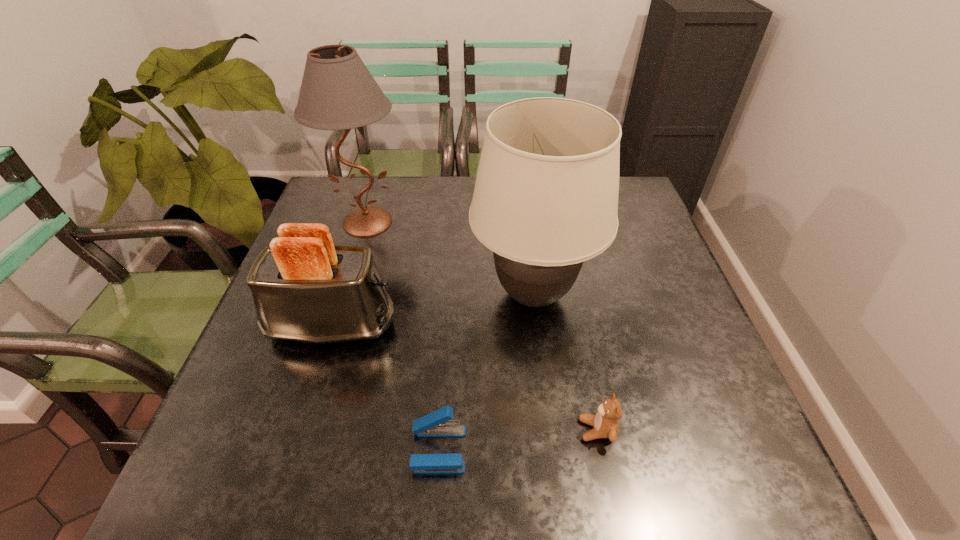
You are a GUI agent. You are given a task and a screenshot of the screen. Output one action in this format:
    pyautogui.click(x=<x>, y=<y>)
    Task: Click on the free spot at the near edge of the desktop
    Image resolution: width=960 pixels, height=540 pixels.
    Given the screenshot: What is the action you would take?
    pyautogui.click(x=477, y=474)

In the image, there is a desktop. Where is `vacant space at the right edge`? vacant space at the right edge is located at coordinates (708, 384).

Find the location of a particular element. The height and width of the screenshot is (540, 960). empty location between the teddy bear and the farthest object is located at coordinates (482, 326).

Where is `free space that is in between the third shortest object and the fourth tallest object`? The height and width of the screenshot is (540, 960). free space that is in between the third shortest object and the fourth tallest object is located at coordinates [x=465, y=377].

Where is `free point between the shortest object and the toaster`? The width and height of the screenshot is (960, 540). free point between the shortest object and the toaster is located at coordinates (385, 387).

Identify the location of vacant space in between the fourth tallest object and the third object from left to right. The height and width of the screenshot is (540, 960). (517, 440).

The height and width of the screenshot is (540, 960). I want to click on free area in between the third object from right to left and the table lamp, so click(x=403, y=335).

What are the coordinates of `vacant space that is in between the farthest object and the lampshade` in the screenshot? It's located at (450, 259).

Where is `vacant space that's between the fourth tallest object and the toaster`? This screenshot has height=540, width=960. vacant space that's between the fourth tallest object and the toaster is located at coordinates coord(465,377).

Locate an element on the screen. vacant area that lies between the shortest object and the third shortest object is located at coordinates (385, 387).